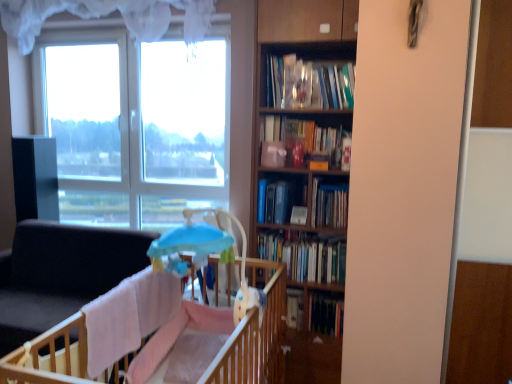
Question: From the image's perspective, is hardcover book at center, which appears as the 2th book when ordered from the bottom, located above or below hardcover book at center, the 5th book viewed from the top?

Choices:
 (A) below
 (B) above

Answer: (B)

Question: Is hardcover book at center, which appears as the 2th book when ordered from the bottom, taller or shorter than hardcover book at center, the 5th book viewed from the top?

Choices:
 (A) short
 (B) tall

Answer: (B)

Question: Which is nearer to the white sheer curtain at upper center?

Choices:
 (A) hardcover books at center, marked as the third book in a bottom-to-top arrangement
 (B) light blue fabric swivel chair at center
 (C) wooden crib at lower left
 (D) wooden bookcase at center
 (E) blue hardcover book at center, the 2th book viewed from the top

Answer: (D)

Question: Considering the real-world distances, which object is farthest from the light blue fabric swivel chair at center?

Choices:
 (A) wooden bookcase at center
 (B) hardcover books at center, which is the third book in top-to-bottom order
 (C) blue hardcover book at center, which appears as the fourth book when ordered from the bottom
 (D) matte orange bookshelf at center, which is the 1th book in top-to-bottom order
 (E) wooden crib at lower left

Answer: (D)